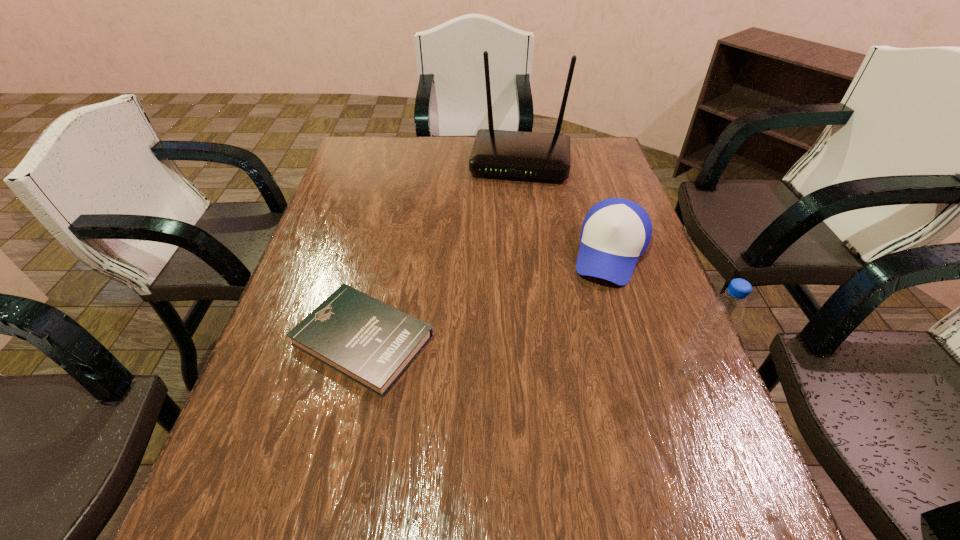
What are the coordinates of `vacant area situated 0.110m on the front-facing side of the third tallest object` in the screenshot? It's located at (592, 317).

Identify the location of vacant area situated on the front-facing side of the third tallest object. click(x=586, y=333).

Where is `free space located 0.060m on the front-facing side of the router`? The height and width of the screenshot is (540, 960). free space located 0.060m on the front-facing side of the router is located at coordinates (514, 197).

Find the location of a particular element. This screenshot has width=960, height=540. free location located on the front-facing side of the router is located at coordinates (510, 227).

At what (x,y) coordinates should I click in order to perform the action: click on free space located 0.320m on the front-facing side of the router. Please return your answer as a coordinate pair (x, y). The width and height of the screenshot is (960, 540). Looking at the image, I should click on (505, 253).

Find the location of a particular element. The image size is (960, 540). object at the far edge is located at coordinates (533, 155).

Identify the location of object at the left edge. coord(372,343).

You are a GUI agent. You are given a task and a screenshot of the screen. Output one action in this format:
    pyautogui.click(x=<x>, y=<y>)
    Task: Click on the water bottle positioned at the right edge
    
    Given the screenshot: What is the action you would take?
    pyautogui.click(x=724, y=315)

I want to click on baseball cap positioned at the right edge, so click(x=615, y=233).

The image size is (960, 540). What are the coordinates of `router that is at the right edge` in the screenshot? It's located at (533, 155).